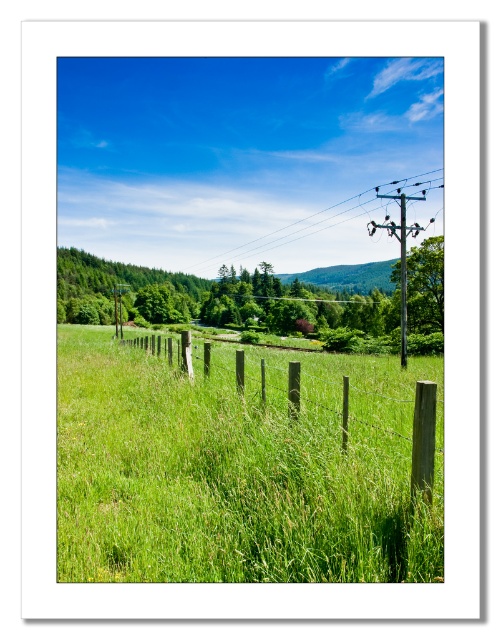
You are a bird flying over the rural landscape. You see the metallic wire at upper right and the brown wooden fence at center. Which one is higher from the ground?

The metallic wire at upper right is taller than the brown wooden fence at center, so the metallic wire at upper right is higher from the ground.

You are a bird flying over the rural landscape. You spot the metallic wire at upper right and the smooth wooden telegraph pole at right. Which object is farther from your current position?

The metallic wire at upper right is 181.33 feet away from the smooth wooden telegraph pole at right. Since you are flying over the landscape, the distance between them doesn t directly indicate which is farther from your position. Without knowing your exact location, it s impossible to determine which is farther.

You are a photographer standing at the camera position in the scene. You want to capture a closeup shot of the metallic wire at upper right. Given that your longest lens can focus on objects up to 25 meters away, will you be able to take the photo without moving closer?

The metallic wire at upper right is 27.55 meters away from the camera, which is beyond the 25 meters focusing limit of your longest lens. Therefore, you will not be able to take a clear closeup shot without moving closer.